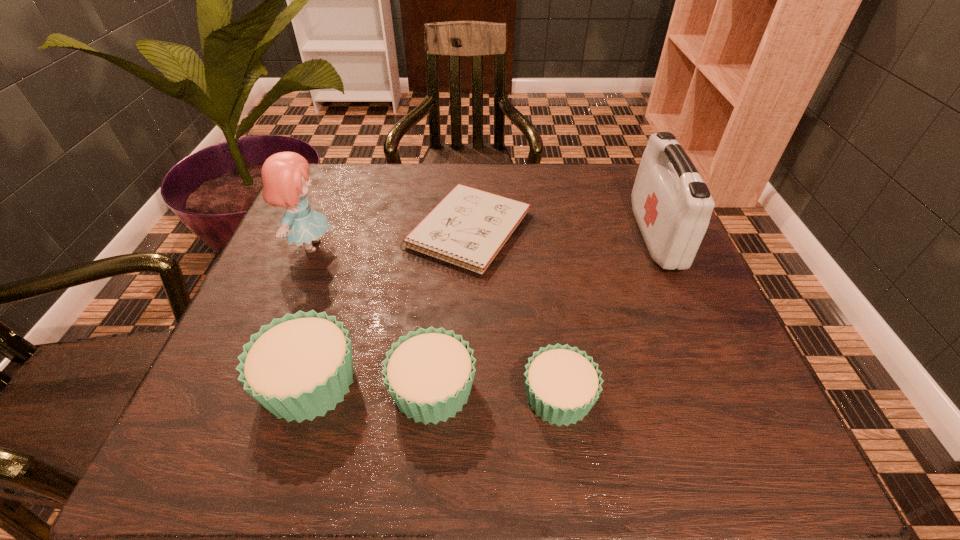
The height and width of the screenshot is (540, 960). I want to click on free spot between the notepad and the first-aid kit, so click(x=563, y=233).

Locate an element on the screen. empty space between the notepad and the rightmost object is located at coordinates (563, 233).

What are the coordinates of `free space between the second tallest cupcake and the shortest object` in the screenshot? It's located at (451, 310).

Locate an element on the screen. blank region between the second shortest object and the doll is located at coordinates (435, 321).

The image size is (960, 540). Identify the location of vacant space in between the rightmost object and the fourth tallest object. (544, 312).

The height and width of the screenshot is (540, 960). I want to click on empty space that is in between the second shortest cupcake and the shortest object, so click(x=451, y=310).

This screenshot has width=960, height=540. In order to click on free spot between the leftmost cupcake and the second shortest cupcake in this screenshot , I will do `click(371, 386)`.

Locate an element on the screen. The width and height of the screenshot is (960, 540). vacant point located between the leftmost cupcake and the shortest object is located at coordinates (390, 306).

Image resolution: width=960 pixels, height=540 pixels. I want to click on vacant space that's between the rightmost object and the fourth tallest object, so click(544, 312).

The height and width of the screenshot is (540, 960). Find the location of `object that can be found as the second closest to the third shortest object`. object that can be found as the second closest to the third shortest object is located at coordinates (562, 383).